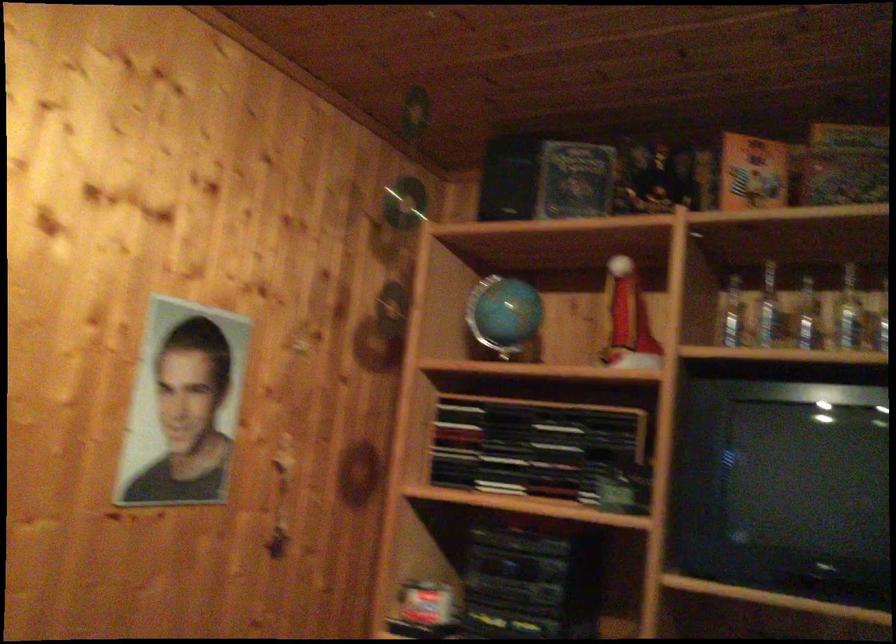
Question: The images are taken continuously from a first-person perspective. In which direction is your viewpoint rotating?

Choices:
 (A) Left
 (B) Right
 (C) Up
 (D) Down

Answer: (B)